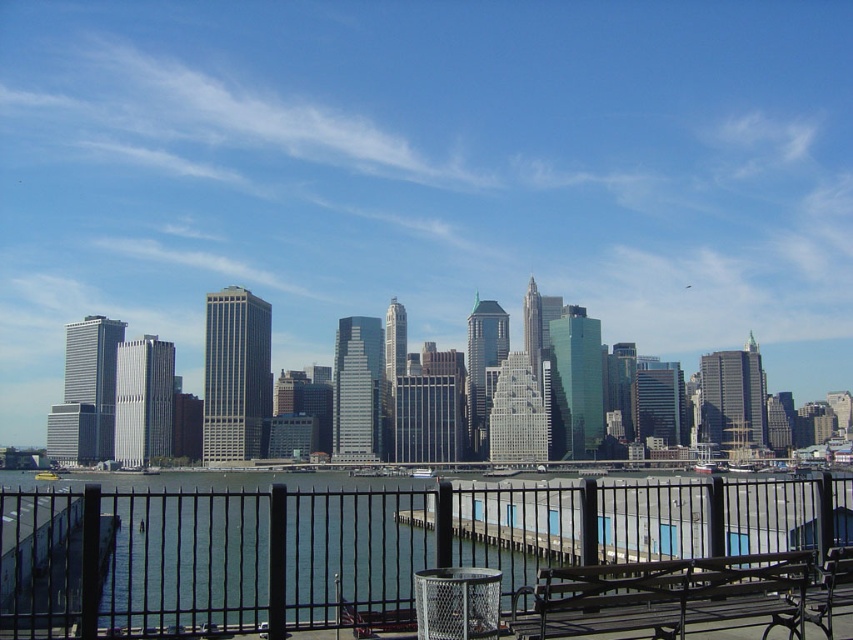
You are a photographer standing on a pier and want to capture a photo of the clear water at lower center. The camera you are using has a minimum focusing distance of 2 meters. Will you need to adjust your position to take a clear photo?

The clear water at lower center is 256.38 feet away from the camera. Since 256.38 feet is much greater than 2 meters, the photographer does not need to adjust their position and can focus on the clear water at lower center without issue.

You are standing on the dock and want to sit down. You see the clear water at lower center and the brown wooden bench at lower right. Which object is closer to you?

The clear water at lower center is closer to you than the brown wooden bench at lower right.

You are a tourist visiting the city and want to sit on the brown wooden bench at lower right while still having a view of the clear water at lower center. Is the bench positioned in a way that allows you to see the water?

The clear water at lower center is located below the brown wooden bench at lower right, so yes, the bench is positioned such that you can see the water below it.